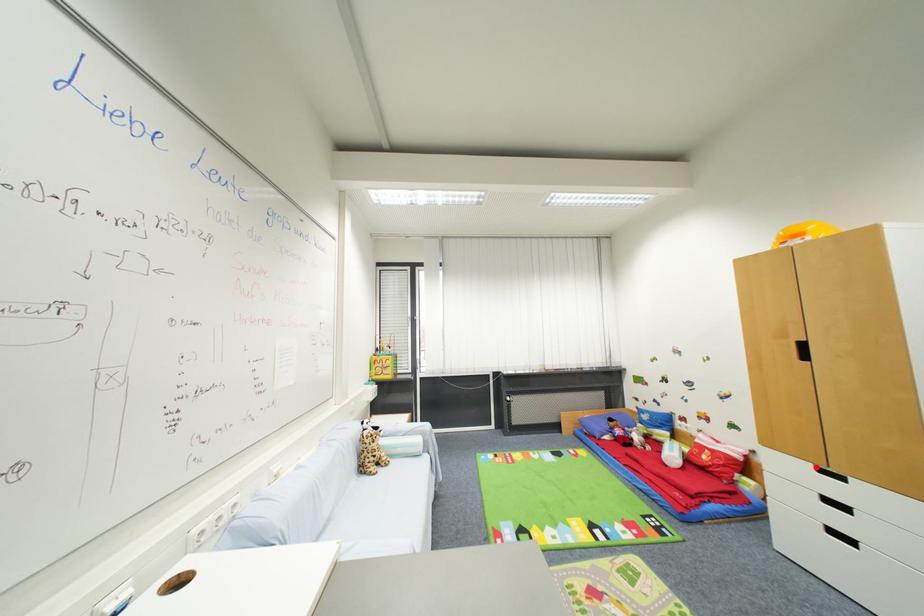
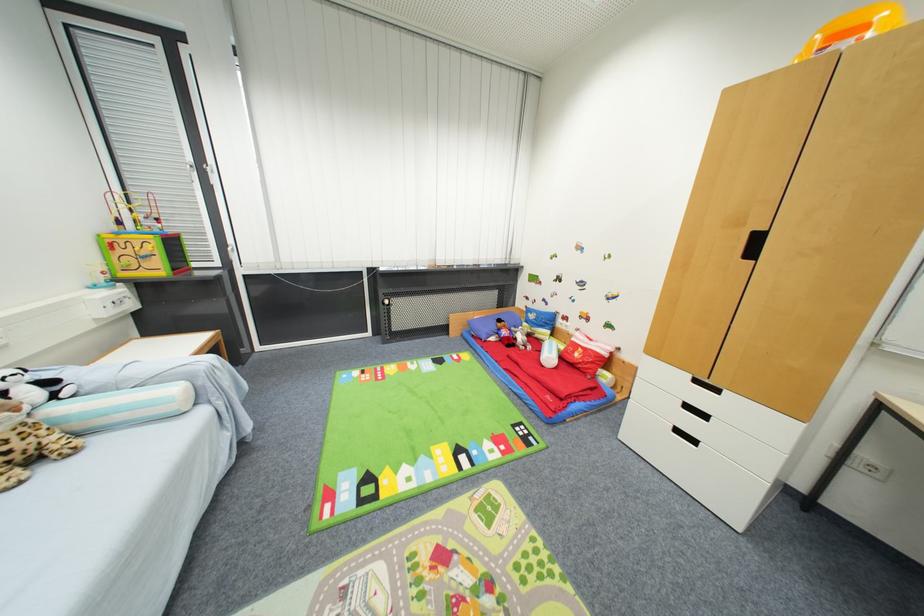
Find the pixel in the second image that matches the highlighted location in the first image.

(695, 378)